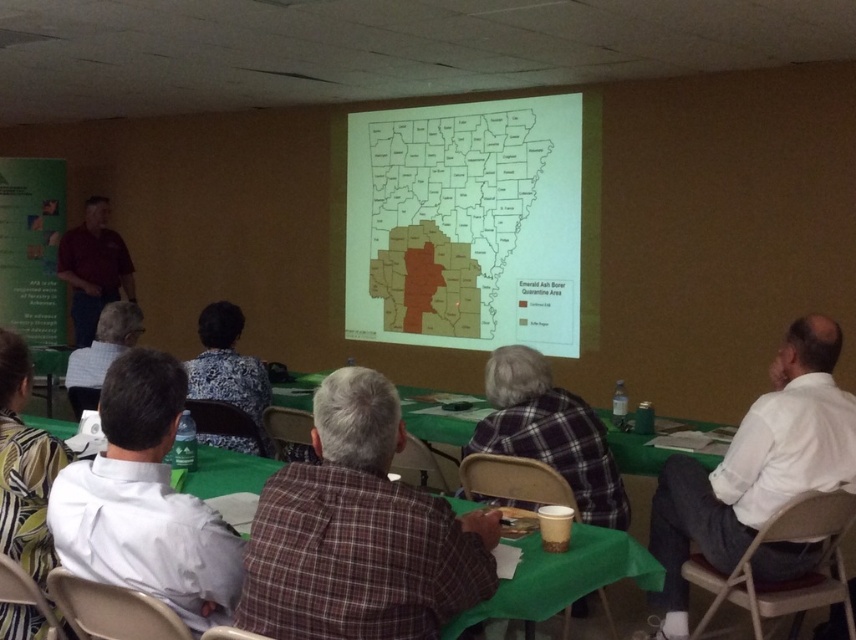
Question: Does matte paper map at upper center come in front of white shirt at center?

Choices:
 (A) yes
 (B) no

Answer: (B)

Question: Based on their relative distances, which object is nearer to the matte paper map at upper center?

Choices:
 (A) green fabric table at lower center
 (B) plaid shirt at center
 (C) maroon shirt at left

Answer: (C)

Question: Which is nearer to the green fabric table at lower center?

Choices:
 (A) matte paper map at upper center
 (B) maroon shirt at left
 (C) white shirt at center
 (D) plaid shirt at center

Answer: (D)

Question: Does white shirt at center appear on the left side of green fabric table at lower center?

Choices:
 (A) no
 (B) yes

Answer: (B)

Question: Is matte paper map at upper center smaller than white shirt at center?

Choices:
 (A) yes
 (B) no

Answer: (B)

Question: Which point is closer to the camera taking this photo?

Choices:
 (A) (676, 529)
 (B) (486, 280)
 (C) (129, 554)
 (D) (568, 586)

Answer: (C)